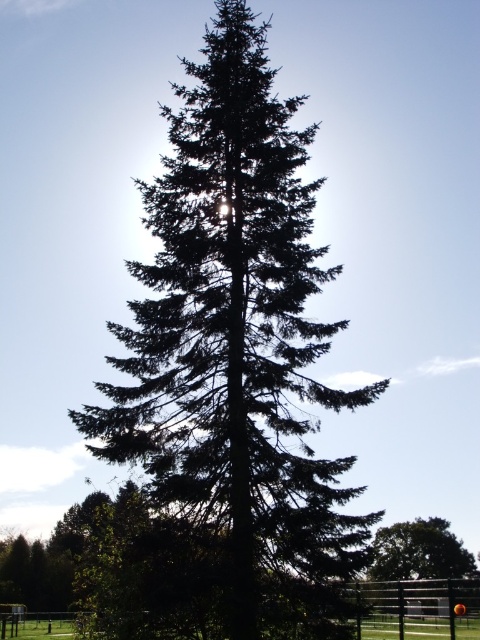
You are standing in front of the tall evergreen tree and notice two points marked on the image. The first point is at coordinates point [222,257] and the second is at point [398,547]. Which point is closer to you?

Point [222,257] is in front of point [398,547], so it is closer to you.